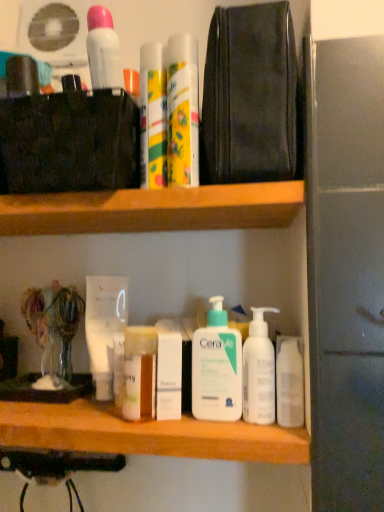
Question: Would you consider white pump bottle at center, the 2th cleaning product positioned from the right, to be distant from wooden at upper center?

Choices:
 (A) yes
 (B) no

Answer: (B)

Question: Can you confirm if white pump bottle at center, which is counted as the first cleaning product, starting from the left, is positioned to the right of wooden at upper center?

Choices:
 (A) yes
 (B) no

Answer: (A)

Question: Does white pump bottle at center, which is counted as the first cleaning product, starting from the left, have a lesser height compared to wooden at upper center?

Choices:
 (A) no
 (B) yes

Answer: (A)

Question: Is the depth of white pump bottle at center, which is counted as the first cleaning product, starting from the left, less than that of wooden at upper center?

Choices:
 (A) no
 (B) yes

Answer: (A)

Question: Is white pump bottle at center, which is counted as the first cleaning product, starting from the left, with wooden at upper center?

Choices:
 (A) no
 (B) yes

Answer: (A)

Question: Is white pump bottle at center, the 2th cleaning product positioned from the right, taller than wooden at upper center?

Choices:
 (A) no
 (B) yes

Answer: (B)

Question: Is white matte tube at center, the 1th mouthwash positioned from the left, taller than translucent plastic jar at center, the 2th toiletry in the bottom-to-top sequence?

Choices:
 (A) yes
 (B) no

Answer: (A)

Question: Is white matte tube at center, which ranks as the first mouthwash in back-to-front order, shorter than translucent plastic jar at center, which appears as the second toiletry when viewed from the top?

Choices:
 (A) no
 (B) yes

Answer: (A)

Question: Is white matte tube at center, the 1th mouthwash positioned from the left, at the left side of translucent plastic jar at center, which appears as the second toiletry when viewed from the top?

Choices:
 (A) yes
 (B) no

Answer: (A)

Question: Can you confirm if white matte tube at center, the 1th mouthwash positioned from the left, is smaller than translucent plastic jar at center, which appears as the second toiletry when viewed from the top?

Choices:
 (A) no
 (B) yes

Answer: (A)

Question: Is white matte tube at center, placed as the third mouthwash when sorted from right to left, far from translucent plastic jar at center, the 2th toiletry in the bottom-to-top sequence?

Choices:
 (A) yes
 (B) no

Answer: (B)

Question: From a real-world perspective, is white matte tube at center, the third mouthwash from the front, beneath translucent plastic jar at center, which appears as the second toiletry when viewed from the top?

Choices:
 (A) yes
 (B) no

Answer: (B)

Question: From the image's perspective, is white pump bottle at center, acting as the first cleaning product starting from the right, beneath white pump bottle at center, which is counted as the first cleaning product, starting from the left?

Choices:
 (A) no
 (B) yes

Answer: (B)